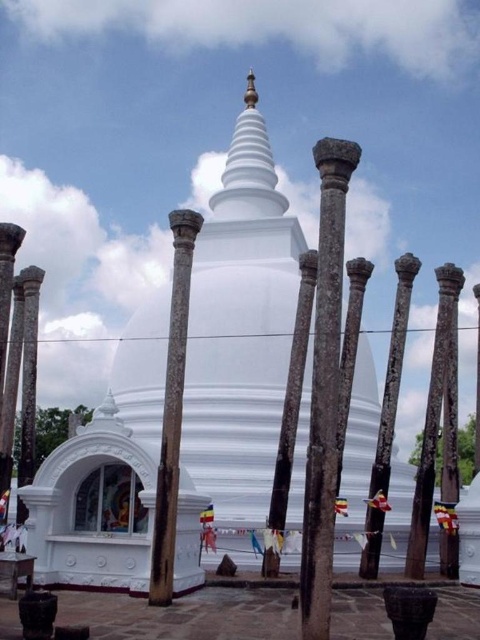
Question: Which point is closer to the camera?

Choices:
 (A) smooth stone column at center
 (B) brown stone column at center
 (C) smooth stone pole at center
 (D) rusty metal pole at center

Answer: (B)

Question: Which point is farther to the camera?

Choices:
 (A) white smooth stupa at center
 (B) smooth stone column at center

Answer: (A)

Question: Is white smooth stupa at center positioned behind smooth stone pole at center?

Choices:
 (A) no
 (B) yes

Answer: (B)

Question: Which of the following is the closest to the observer?

Choices:
 (A) smooth stone pillar at center
 (B) brown stone column at center
 (C) smooth stone pole at center

Answer: (B)

Question: From the image, what is the correct spatial relationship of brown stone column at center in relation to smooth stone pillar at center?

Choices:
 (A) below
 (B) above

Answer: (B)

Question: Is brown stone column at center above smooth stone pillar at center?

Choices:
 (A) yes
 (B) no

Answer: (A)